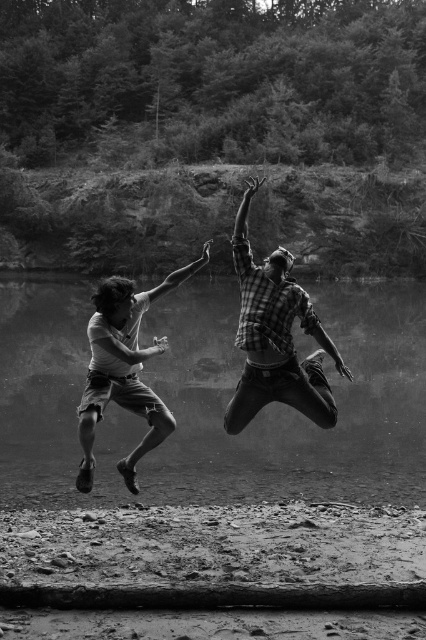
Question: Is plaid shirt at center closer to camera compared to matte white shirt at center?

Choices:
 (A) no
 (B) yes

Answer: (B)

Question: Can you confirm if plaid shirt at center is thinner than checkered fabric man at center?

Choices:
 (A) no
 (B) yes

Answer: (A)

Question: From the image, what is the correct spatial relationship of checkered fabric man at center in relation to rough textured log at lower center?

Choices:
 (A) left
 (B) right

Answer: (B)

Question: Which object appears farthest from the camera in this image?

Choices:
 (A) plaid shirt at center
 (B) matte white shirt at center

Answer: (B)

Question: Which of the following is the closest to the observer?

Choices:
 (A) rough textured log at lower center
 (B) plaid shirt at center

Answer: (A)

Question: Among these objects, which one is nearest to the camera?

Choices:
 (A) checkered fabric man at center
 (B) plaid shirt at center
 (C) rough textured log at lower center
 (D) matte white shirt at center

Answer: (C)